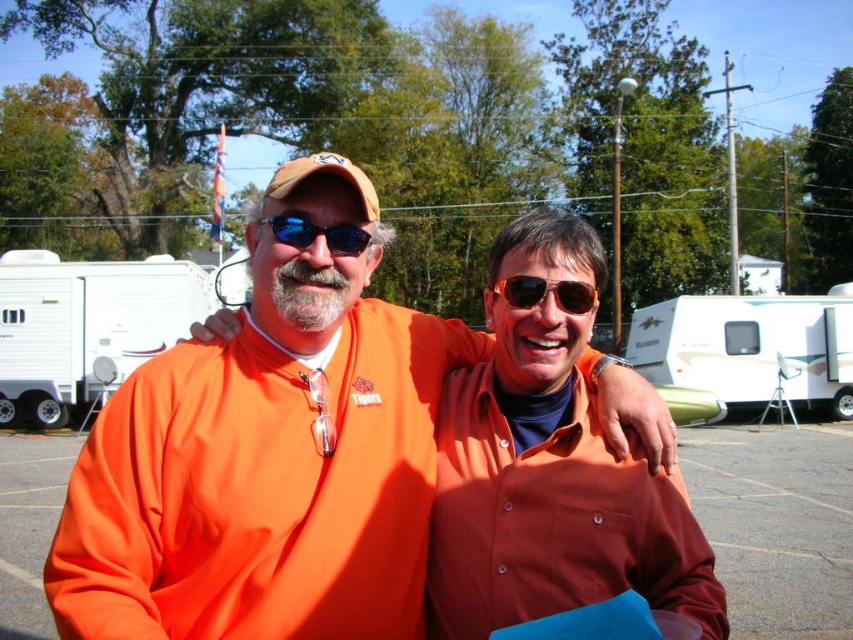
Question: Does white plastic trailer at left have a greater width compared to gold reflective sunglasses at center?

Choices:
 (A) yes
 (B) no

Answer: (A)

Question: Estimate the real-world distances between objects in this image. Which object is closer to the white glossy trailer at right?

Choices:
 (A) gold reflective sunglasses at center
 (B) white plastic trailer at left
 (C) blue reflective sunglasses at center

Answer: (B)

Question: Can you confirm if gold reflective sunglasses at center is smaller than blue reflective sunglasses at center?

Choices:
 (A) no
 (B) yes

Answer: (A)

Question: Which object is the farthest from the gold reflective sunglasses at center?

Choices:
 (A) white glossy trailer at right
 (B) blue reflective sunglasses at center

Answer: (A)

Question: Observing the image, what is the correct spatial positioning of white plastic trailer at left in reference to white glossy trailer at right?

Choices:
 (A) left
 (B) right

Answer: (A)

Question: Which point is closer to the camera taking this photo?

Choices:
 (A) click(566, 294)
 (B) click(291, 227)

Answer: (B)